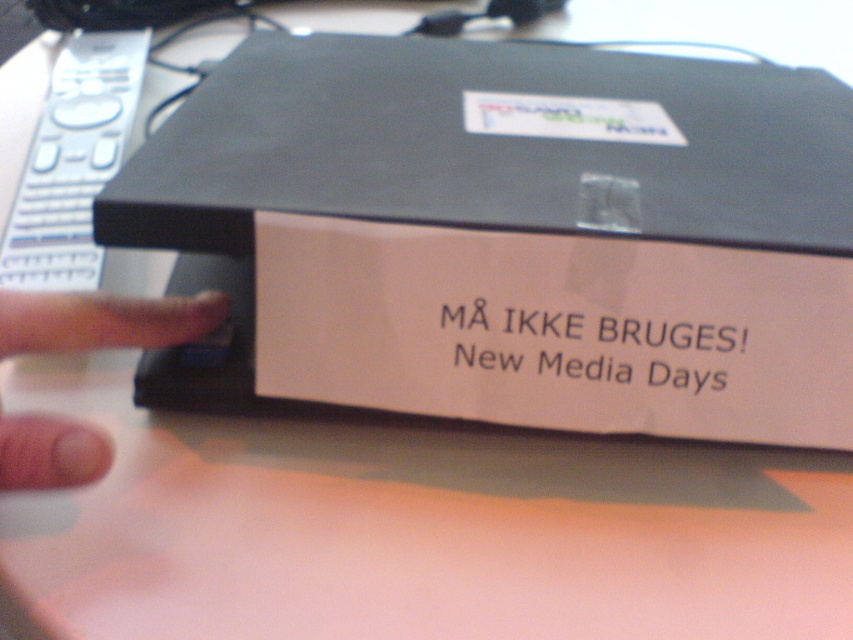
What is located at the coordinates point (x=73, y=163) in the image?

The point (x=73, y=163) marks the location of the white plastic remote at upper left.

You are a technician trying to locate two points on the device. The first point is at coordinates point (115, 152) and the second is at point (196, 300). From your current position, which point is closer to you?

Point (196, 300) is closer to you because it is in front of point (115, 152).